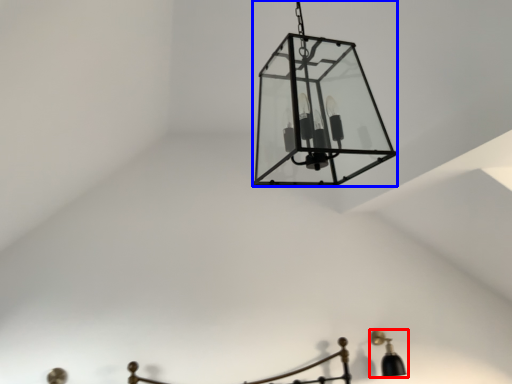
Question: Which object appears closest to the camera in this image, lamp (highlighted by a red box) or lamp (highlighted by a blue box)?

Choices:
 (A) lamp
 (B) lamp

Answer: (B)